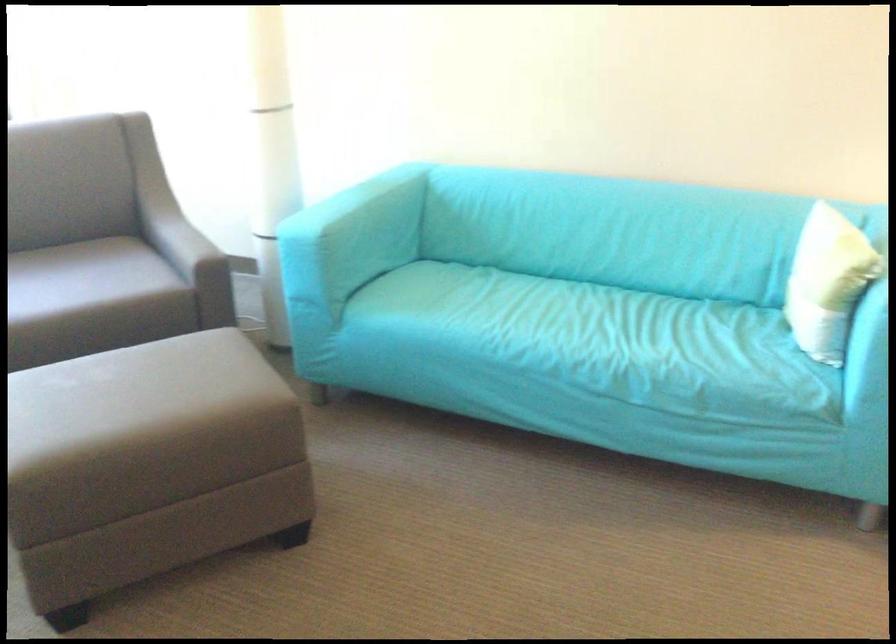
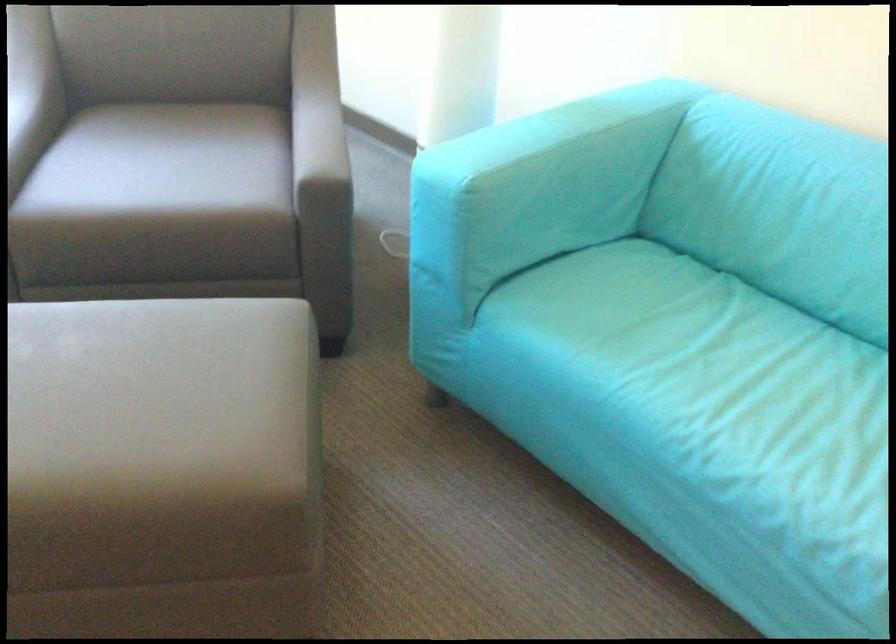
In the second image, find the point that corresponds to (351,211) in the first image.

(554, 162)